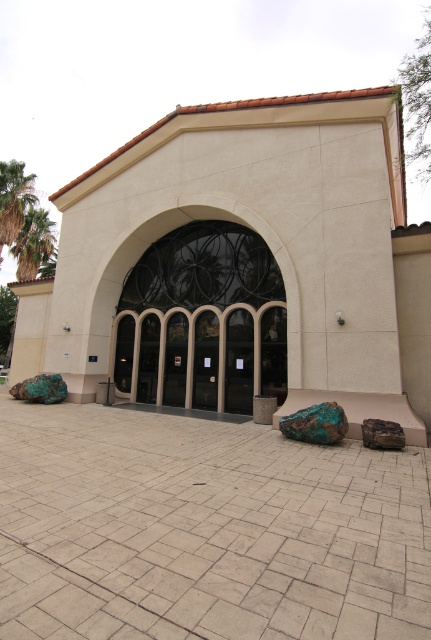
You are standing at the entrance of the building and want to water the green leafy palm tree at left. If your watering can holds enough water for 30 meters of walking, will you be able to reach the tree without refilling?

The green leafy palm tree at left and viewer are 27.89 meters apart from each other, so yes, you can reach the tree without needing to refill your watering can since the distance is within the 30 meters capacity.

You are planning to place a new decorative pot that is 1.2 meters wide in front of the beige stone archway at center. Considering the size of the green rough stone at lower right, will the pot fit between them without moving either object?

The beige stone archway at center is smaller than the green rough stone at lower right. Since the pot is 1.2 meters wide, but the exact distance between the two stones isn

You are standing at the entrance of the building and want to place a small bench between the green leafy palm tree at left and the green rough stone at lower right. Based on their positions, where should you place the bench so it is between them?

The green leafy palm tree at left is located above the green rough stone at lower right, so placing the bench between them would require positioning it below the palm tree and above the green rough stone at lower right.